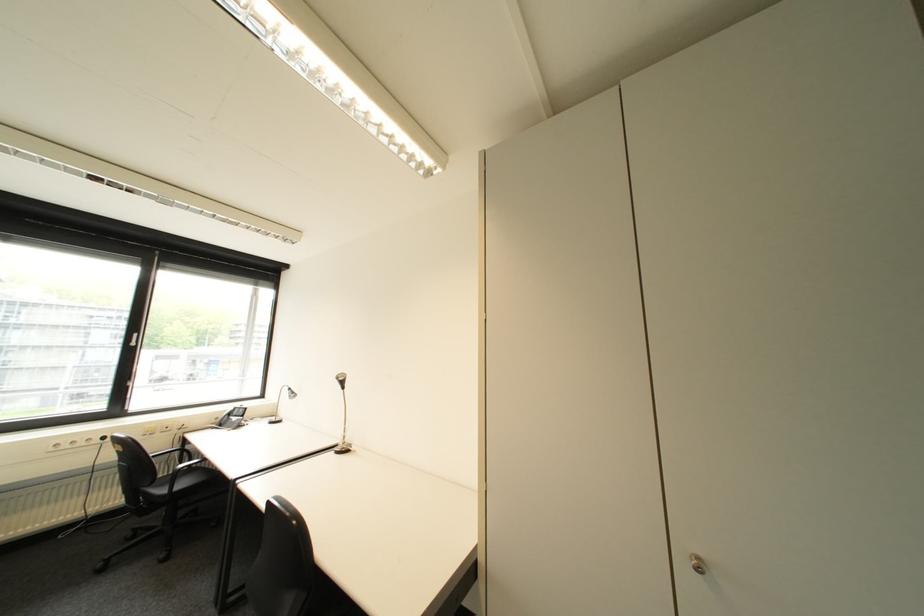
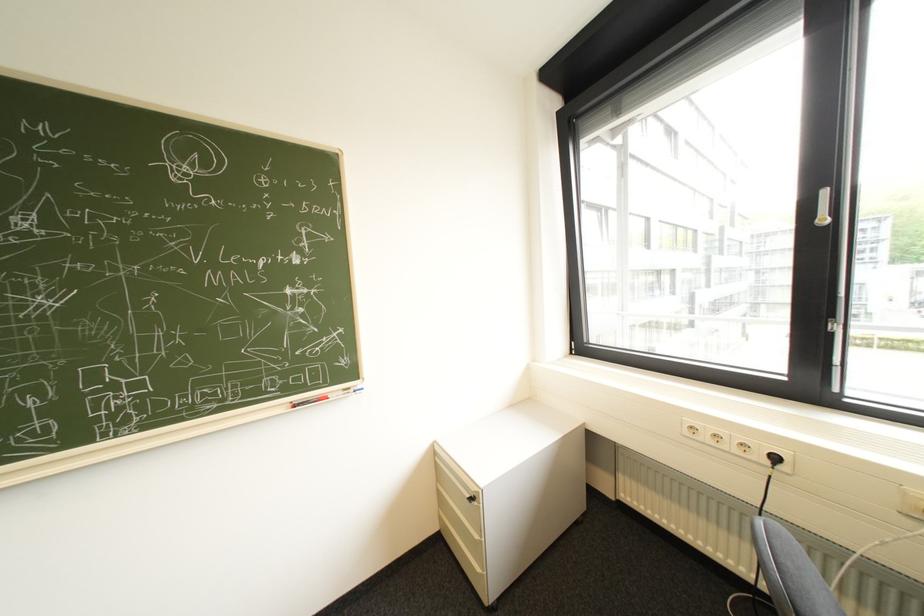
Locate, in the second image, the point that corresponds to point 111,442 in the first image.

(779, 463)